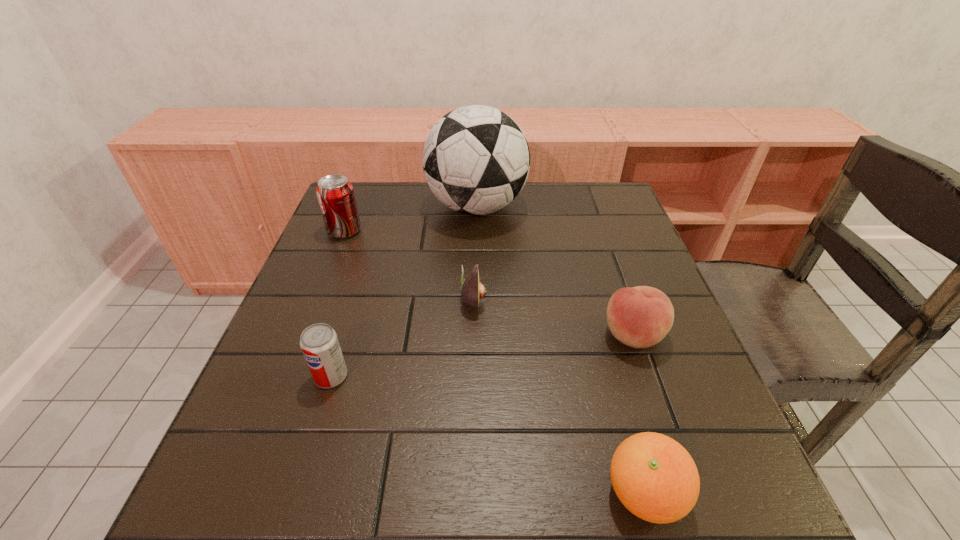
What are the coordinates of `free region located 0.240m on the seed side of the avocado` in the screenshot? It's located at (595, 300).

The width and height of the screenshot is (960, 540). Find the location of `vacant space located on the back of the fifth farthest object`. vacant space located on the back of the fifth farthest object is located at coordinates (351, 311).

Where is `blank space located on the left of the peach`? Image resolution: width=960 pixels, height=540 pixels. blank space located on the left of the peach is located at coordinates (479, 336).

Locate an element on the screen. vacant space located on the left of the orange is located at coordinates (438, 494).

What are the coordinates of `soccer ball that is at the far edge` in the screenshot? It's located at (476, 159).

Locate an element on the screen. The width and height of the screenshot is (960, 540). soda can located in the far edge section of the desktop is located at coordinates (335, 194).

At what (x,y) coordinates should I click in order to perform the action: click on object located in the near edge section of the desktop. Please return your answer as a coordinate pair (x, y). This screenshot has width=960, height=540. Looking at the image, I should click on (655, 478).

The height and width of the screenshot is (540, 960). What are the coordinates of `peach positioned at the right edge` in the screenshot? It's located at (640, 317).

Locate an element on the screen. The width and height of the screenshot is (960, 540). orange present at the right edge is located at coordinates (655, 478).

Where is `object at the far left corner`? Image resolution: width=960 pixels, height=540 pixels. object at the far left corner is located at coordinates (335, 194).